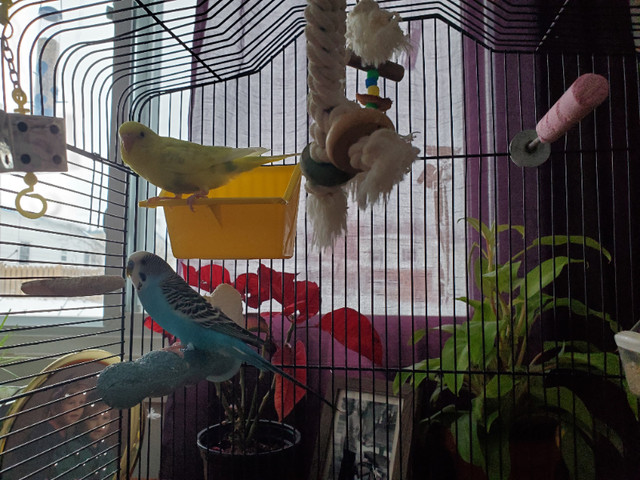
The width and height of the screenshot is (640, 480). In order to click on hanging toy in this screenshot , I will do `click(349, 137)`.